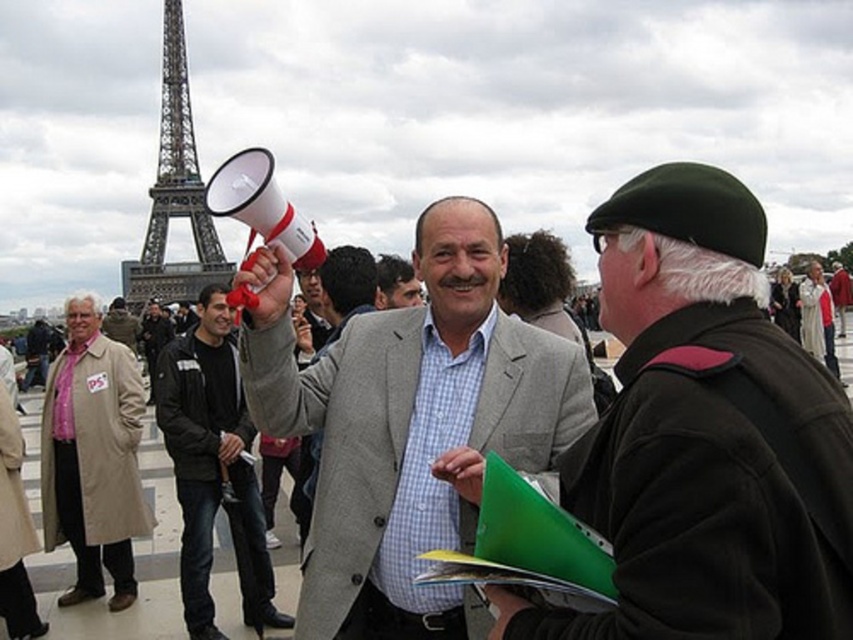
You are an observer standing in the scene. You notice two jackets at the center of the image. Which one is taller, the light gray wool jacket at center or the matte black jacket at center?

The light gray wool jacket at center has a greater height compared to the matte black jacket at center.

You are an artist trying to sketch this scene. You want to ensure the beige wool coat at left and the metallic gray eiffel tower at upper left are proportionally accurate. Which object should you draw first to maintain the correct size relationship between them?

You should draw the metallic gray eiffel tower at upper left first because it is wider than the beige wool coat at left, so starting with the wider object ensures proper scaling when adding the narrower one.

You are standing at the center of the scene and want to hand a brochure to the person wearing the light gray wool jacket at center. In which direction should you move to reach them?

The light gray wool jacket at center is located at point 0.681 on the x and 0.826 on the y coordinates, so you should move towards the lower right direction to reach them.